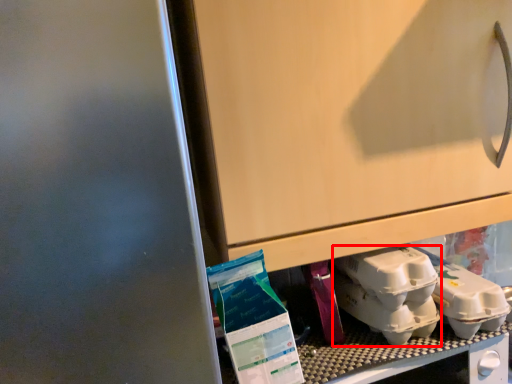
Question: Observing the image, what is the correct spatial positioning of yoghurt (annotated by the red box) in reference to yoghurt?

Choices:
 (A) left
 (B) right

Answer: (B)